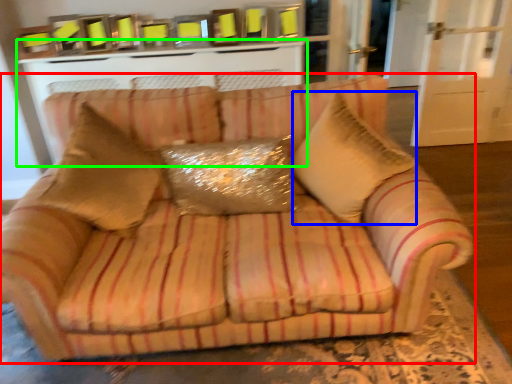
Question: Which object is positioned closest to studio couch (highlighted by a red box)? Select from throw pillow (highlighted by a blue box) and table (highlighted by a green box).

Choices:
 (A) throw pillow
 (B) table

Answer: (A)